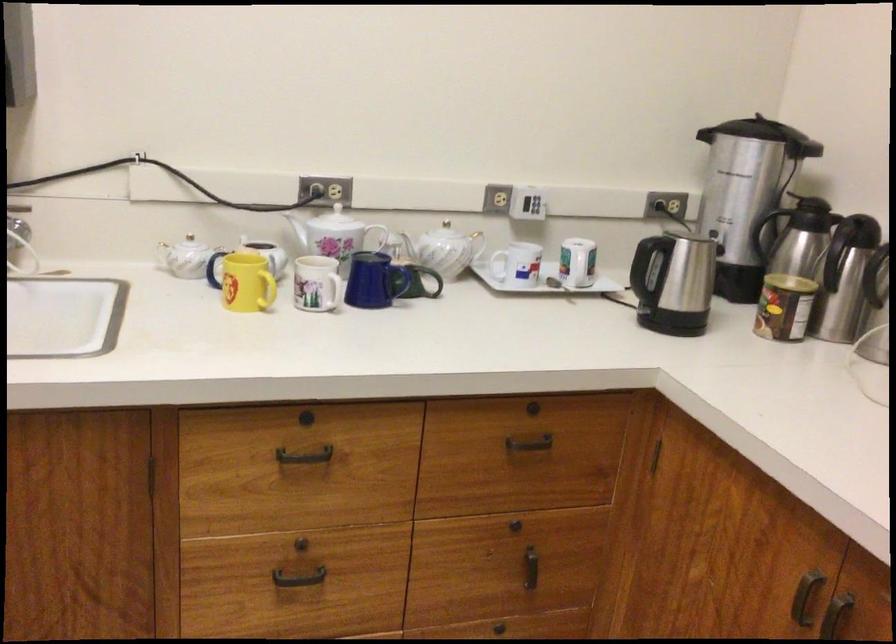
Where would you lift the white teapot handle? Please return your answer as a coordinate pair (x, y).

(382, 236)